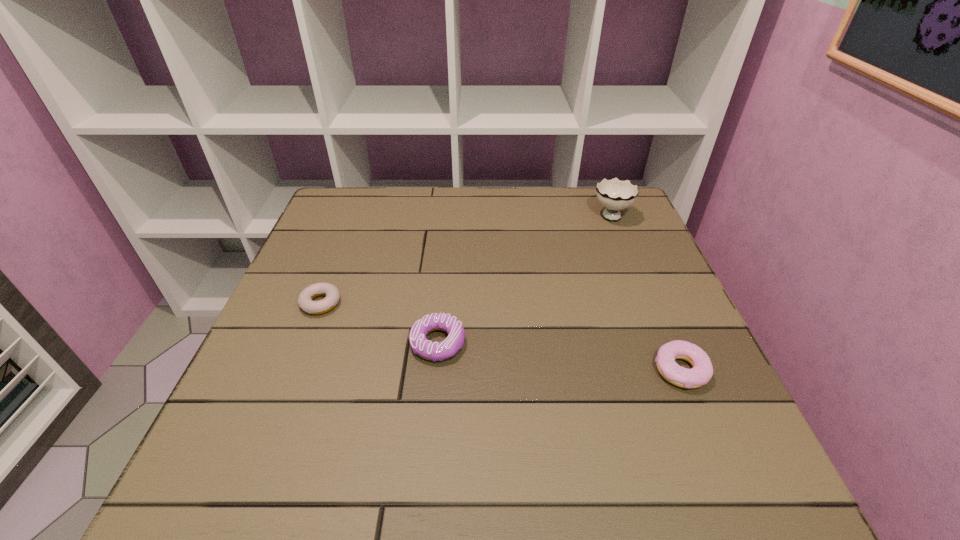
Image resolution: width=960 pixels, height=540 pixels. In order to click on vacant area situated on the front of the leftmost doughnut in this screenshot , I will do `click(297, 367)`.

Where is `object located at the far edge`? object located at the far edge is located at coordinates (614, 194).

The image size is (960, 540). In order to click on object that is at the left edge in this screenshot , I will do `click(332, 294)`.

Where is `cup that is at the right edge`? This screenshot has height=540, width=960. cup that is at the right edge is located at coordinates (614, 194).

I want to click on doughnut situated at the right edge, so click(x=701, y=373).

What are the coordinates of `object present at the far right corner` in the screenshot? It's located at (614, 194).

In the image, there is a desktop. At what (x,y) coordinates should I click in order to perform the action: click on vacant space at the far edge. Please return your answer as a coordinate pair (x, y). This screenshot has height=540, width=960. Looking at the image, I should click on (503, 206).

In the image, there is a desktop. Where is `vacant space at the near edge`? vacant space at the near edge is located at coordinates (594, 476).

This screenshot has width=960, height=540. In the image, there is a desktop. Find the location of `free space at the left edge`. free space at the left edge is located at coordinates (308, 381).

The width and height of the screenshot is (960, 540). In the image, there is a desktop. What are the coordinates of `vacant space at the right edge` in the screenshot? It's located at (655, 322).